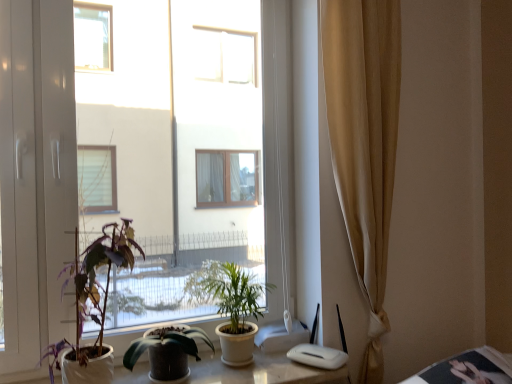
At what (x,y) coordinates should I click in order to perform the action: click on purple matte plant at left, arranged as the first houseplant when viewed from the left. Please return your answer as a coordinate pair (x, y). Looking at the image, I should click on click(93, 293).

Describe the element at coordinates (230, 306) in the screenshot. I see `green leafy plant at center, arranged as the 3th houseplant when viewed from the left` at that location.

This screenshot has width=512, height=384. Find the location of `green glossy plant at center, marked as the second houseplant in a left-to-right arrangement`. green glossy plant at center, marked as the second houseplant in a left-to-right arrangement is located at coordinates (167, 352).

In terms of height, does green glossy plant at center, placed as the second houseplant when sorted from right to left, look taller or shorter compared to beige fabric curtain at right?

green glossy plant at center, placed as the second houseplant when sorted from right to left, is shorter than beige fabric curtain at right.

Considering the relative positions of green glossy plant at center, marked as the second houseplant in a left-to-right arrangement, and beige fabric curtain at right in the image provided, is green glossy plant at center, marked as the second houseplant in a left-to-right arrangement, to the left of beige fabric curtain at right from the viewer's perspective?

Yes.

From a real-world perspective, which object rests below the other?

green glossy plant at center, marked as the second houseplant in a left-to-right arrangement, is physically lower.

Considering the points (176, 333) and (365, 381), which point is in front, point (176, 333) or point (365, 381)?

The point (176, 333) is in front.

Is green glossy plant at center, marked as the second houseplant in a left-to-right arrangement, inside or outside of transparent glass window at center?

green glossy plant at center, marked as the second houseplant in a left-to-right arrangement, fits inside transparent glass window at center.

How many degrees apart are the facing directions of green glossy plant at center, placed as the second houseplant when sorted from right to left, and transparent glass window at center?

green glossy plant at center, placed as the second houseplant when sorted from right to left, and transparent glass window at center are facing 1.82 degrees away from each other.

Is point (170, 361) closer or farther from the camera than point (14, 356)?

Clearly, point (170, 361) is closer to the camera than point (14, 356).

Between green glossy plant at center, placed as the second houseplant when sorted from right to left, and transparent glass window at center, which one has less height?

With less height is green glossy plant at center, placed as the second houseplant when sorted from right to left.

Is purple matte plant at left, arranged as the first houseplant when viewed from the left, beside beige fabric curtain at right?

No, purple matte plant at left, arranged as the first houseplant when viewed from the left, is not touching beige fabric curtain at right.

Is purple matte plant at left, acting as the 3th houseplant starting from the right, at the right side of beige fabric curtain at right?

No, purple matte plant at left, acting as the 3th houseplant starting from the right, is not to the right of beige fabric curtain at right.

From a real-world perspective, between purple matte plant at left, acting as the 3th houseplant starting from the right, and beige fabric curtain at right, who is vertically lower?

From a 3D spatial view, purple matte plant at left, acting as the 3th houseplant starting from the right, is below.

Locate an element on the screen. the 3rd houseplant to the left when counting from the beige fabric curtain at right is located at coordinates (93, 293).

Does green leafy plant at center, which ranks as the 1th houseplant in right-to-left order, have a greater height compared to green glossy plant at center, marked as the second houseplant in a left-to-right arrangement?

Yes, green leafy plant at center, which ranks as the 1th houseplant in right-to-left order, is taller than green glossy plant at center, marked as the second houseplant in a left-to-right arrangement.

At what (x,y) coordinates should I click in order to perform the action: click on houseplant below the green leafy plant at center, arranged as the 3th houseplant when viewed from the left (from a real-world perspective). Please return your answer as a coordinate pair (x, y). Looking at the image, I should click on (167, 352).

Is green leafy plant at center, arranged as the 3th houseplant when viewed from the left, looking in the opposite direction of green glossy plant at center, placed as the second houseplant when sorted from right to left?

No, green glossy plant at center, placed as the second houseplant when sorted from right to left, is not at the back of green leafy plant at center, arranged as the 3th houseplant when viewed from the left.

Is green leafy plant at center, which ranks as the 1th houseplant in right-to-left order, directly adjacent to green glossy plant at center, placed as the second houseplant when sorted from right to left?

green leafy plant at center, which ranks as the 1th houseplant in right-to-left order, is not next to green glossy plant at center, placed as the second houseplant when sorted from right to left, and they're not touching.

Between transparent glass window at center and green leafy plant at center, arranged as the 3th houseplant when viewed from the left, which one has smaller size?

Smaller between the two is green leafy plant at center, arranged as the 3th houseplant when viewed from the left.

Is point (71, 310) farther from camera compared to point (202, 268)?

No, (71, 310) is in front of (202, 268).

From a real-world perspective, who is located lower, transparent glass window at center or green leafy plant at center, arranged as the 3th houseplant when viewed from the left?

In real-world perspective, green leafy plant at center, arranged as the 3th houseplant when viewed from the left, is lower.

Is transparent glass window at center looking in the opposite direction of green leafy plant at center, which ranks as the 1th houseplant in right-to-left order?

Absolutely, transparent glass window at center is directed away from green leafy plant at center, which ranks as the 1th houseplant in right-to-left order.

Would you say green leafy plant at center, which ranks as the 1th houseplant in right-to-left order, is inside or outside beige fabric curtain at right?

The correct answer is: outside.

Measure the distance between green leafy plant at center, which ranks as the 1th houseplant in right-to-left order, and beige fabric curtain at right.

A distance of 20.63 inches exists between green leafy plant at center, which ranks as the 1th houseplant in right-to-left order, and beige fabric curtain at right.

Is green leafy plant at center, which ranks as the 1th houseplant in right-to-left order, to the left of beige fabric curtain at right from the viewer's perspective?

Yes, green leafy plant at center, which ranks as the 1th houseplant in right-to-left order, is to the left of beige fabric curtain at right.

From the image's perspective, is white glossy table at lower right above purple matte plant at left, arranged as the first houseplant when viewed from the left?

Actually, white glossy table at lower right appears below purple matte plant at left, arranged as the first houseplant when viewed from the left, in the image.

Looking at this image, from a real-world perspective, is white glossy table at lower right beneath purple matte plant at left, acting as the 3th houseplant starting from the right?

Yes.

Considering the relative positions of white glossy table at lower right and purple matte plant at left, arranged as the first houseplant when viewed from the left, in the image provided, is white glossy table at lower right to the left of purple matte plant at left, arranged as the first houseplant when viewed from the left, from the viewer's perspective?

No, white glossy table at lower right is not to the left of purple matte plant at left, arranged as the first houseplant when viewed from the left.

Considering the relative sizes of white glossy table at lower right and purple matte plant at left, arranged as the first houseplant when viewed from the left, in the image provided, is white glossy table at lower right smaller than purple matte plant at left, arranged as the first houseplant when viewed from the left,?

Correct, white glossy table at lower right occupies less space than purple matte plant at left, arranged as the first houseplant when viewed from the left.

Where is `the 2nd houseplant in front of the beige fabric curtain at right, counting from the anchor's position`? The height and width of the screenshot is (384, 512). the 2nd houseplant in front of the beige fabric curtain at right, counting from the anchor's position is located at coordinates (167, 352).

I want to click on window above the green glossy plant at center, placed as the second houseplant when sorted from right to left (from a real-world perspective), so click(35, 178).

From the image, which object appears to be farther from white glossy table at lower right, green glossy plant at center, placed as the second houseplant when sorted from right to left, or beige fabric curtain at right?

green glossy plant at center, placed as the second houseplant when sorted from right to left, is positioned further to the anchor white glossy table at lower right.

From the image, which object appears to be nearer to beige fabric curtain at right, green glossy plant at center, marked as the second houseplant in a left-to-right arrangement, or transparent glass window at center?

The object closer to beige fabric curtain at right is green glossy plant at center, marked as the second houseplant in a left-to-right arrangement.

Considering their positions, is transparent glass window at center positioned closer to green leafy plant at center, arranged as the 3th houseplant when viewed from the left, than purple matte plant at left, arranged as the first houseplant when viewed from the left?

purple matte plant at left, arranged as the first houseplant when viewed from the left.

Which object lies further to the anchor point white glossy table at lower right, beige fabric curtain at right or green leafy plant at center, which ranks as the 1th houseplant in right-to-left order?

Based on the image, green leafy plant at center, which ranks as the 1th houseplant in right-to-left order, appears to be further to white glossy table at lower right.

In the scene shown: Based on their spatial positions, is transparent glass window at center or green leafy plant at center, which ranks as the 1th houseplant in right-to-left order, closer to white glossy table at lower right?

green leafy plant at center, which ranks as the 1th houseplant in right-to-left order, lies closer to white glossy table at lower right than the other object.

Looking at the image, which one is located further to white glossy table at lower right, beige fabric curtain at right or green glossy plant at center, marked as the second houseplant in a left-to-right arrangement?

Among the two, green glossy plant at center, marked as the second houseplant in a left-to-right arrangement, is located further to white glossy table at lower right.

When comparing their distances from white glossy table at lower right, does green leafy plant at center, which ranks as the 1th houseplant in right-to-left order, or purple matte plant at left, arranged as the first houseplant when viewed from the left, seem closer?

green leafy plant at center, which ranks as the 1th houseplant in right-to-left order, lies closer to white glossy table at lower right than the other object.

From the image, which object appears to be farther from purple matte plant at left, acting as the 3th houseplant starting from the right, white glossy table at lower right or green glossy plant at center, placed as the second houseplant when sorted from right to left?

white glossy table at lower right is further to purple matte plant at left, acting as the 3th houseplant starting from the right.

The height and width of the screenshot is (384, 512). In order to click on houseplant between green glossy plant at center, marked as the second houseplant in a left-to-right arrangement, and beige fabric curtain at right from left to right in this screenshot , I will do `click(230, 306)`.

In order to click on curtain situated between transparent glass window at center and white glossy table at lower right from left to right in this screenshot , I will do `click(364, 142)`.

This screenshot has width=512, height=384. Find the location of `curtain between green glossy plant at center, placed as the second houseplant when sorted from right to left, and white glossy table at lower right`. curtain between green glossy plant at center, placed as the second houseplant when sorted from right to left, and white glossy table at lower right is located at coordinates (364, 142).

Locate an element on the screen. houseplant between transparent glass window at center and green leafy plant at center, arranged as the 3th houseplant when viewed from the left, in the vertical direction is located at coordinates (93, 293).